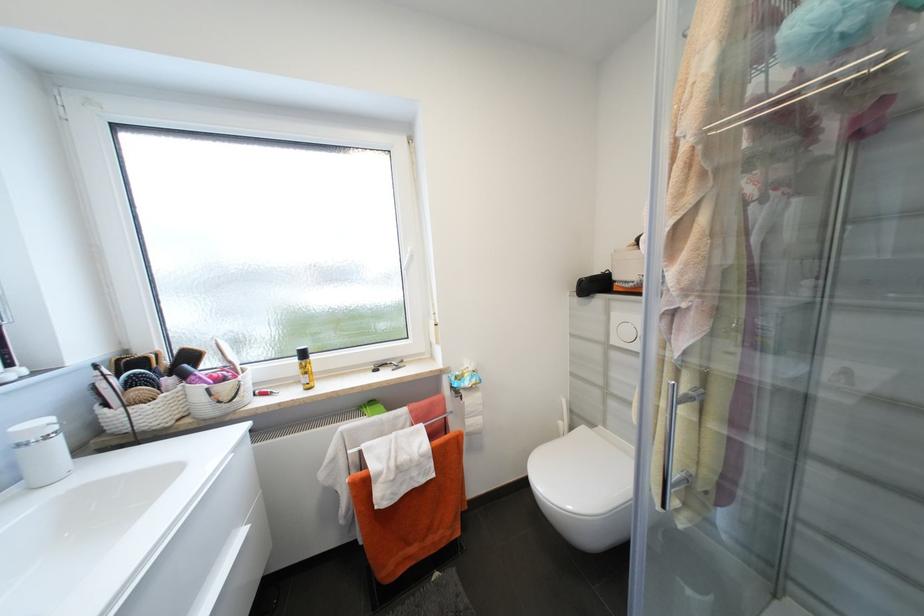
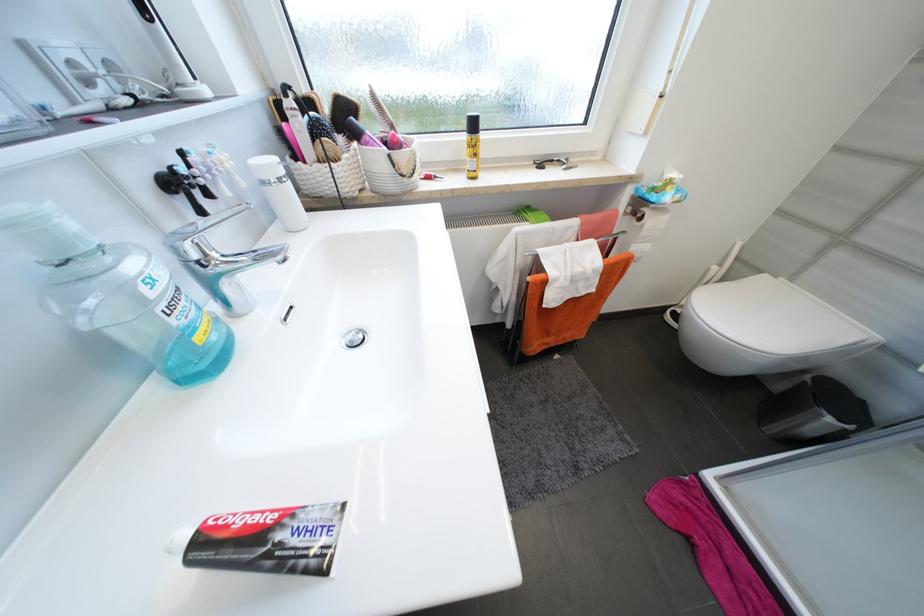
Find the pixel in the second image that matches the point at 310,379 in the first image.

(477, 166)